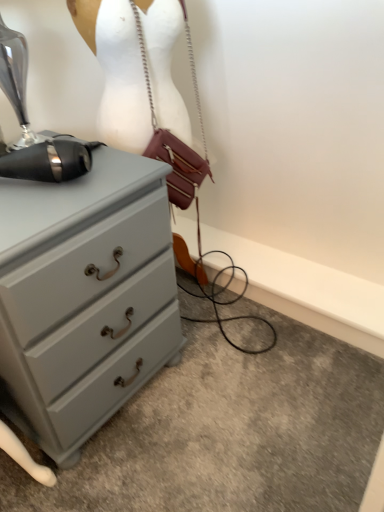
Question: Is leather/metallic handbag at center taller or shorter than matte gray chest of drawers at left?

Choices:
 (A) tall
 (B) short

Answer: (B)

Question: Considering the positions of leather/metallic handbag at center and matte gray chest of drawers at left in the image, is leather/metallic handbag at center bigger or smaller than matte gray chest of drawers at left?

Choices:
 (A) big
 (B) small

Answer: (B)

Question: Which of these objects is positioned closest to the matte gray chest of drawers at left?

Choices:
 (A) black metallic sewing machine at upper left
 (B) leather/metallic handbag at center
 (C) white matte mannequin at upper center

Answer: (A)

Question: Based on their relative distances, which object is farther from the matte gray chest of drawers at left?

Choices:
 (A) white matte mannequin at upper center
 (B) black metallic sewing machine at upper left
 (C) leather/metallic handbag at center

Answer: (C)